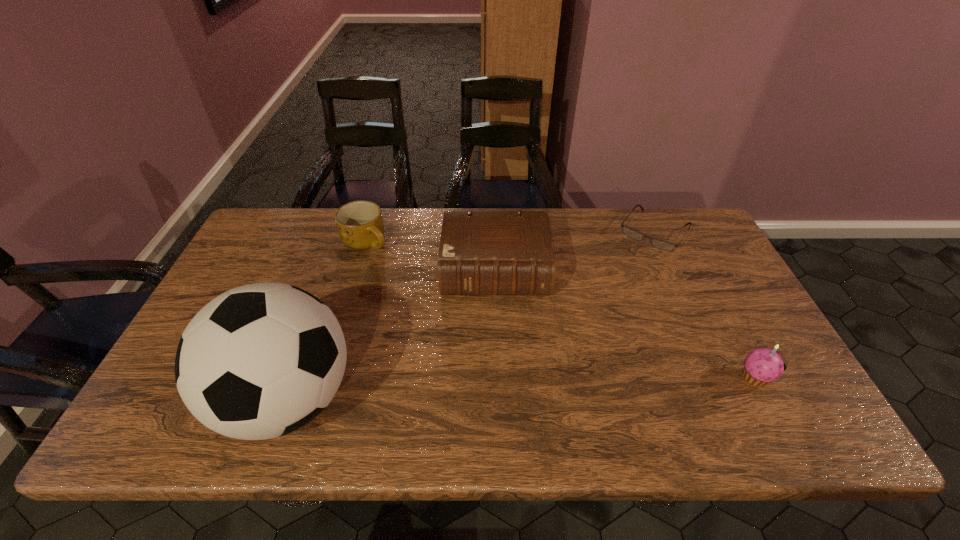
Locate which object is the fourth closest to the cupcake. Please provide its 2D coordinates. Your answer should be formatted as a tuple, i.e. [(x, y)], where the tuple contains the x and y coordinates of a point satisfying the conditions above.

[(360, 225)]

The width and height of the screenshot is (960, 540). I want to click on vacant region that satisfies the following two spatial constraints: 1. on the front side of the cupcake; 2. on the face of the Bible, so click(x=499, y=377).